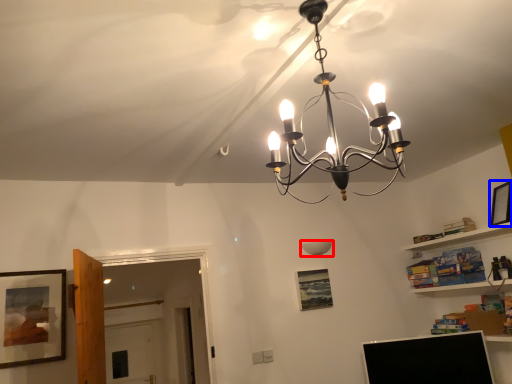
Question: Which of the following is the farthest to the observer, lamp (highlighted by a red box) or picture frame (highlighted by a blue box)?

Choices:
 (A) lamp
 (B) picture frame

Answer: (A)